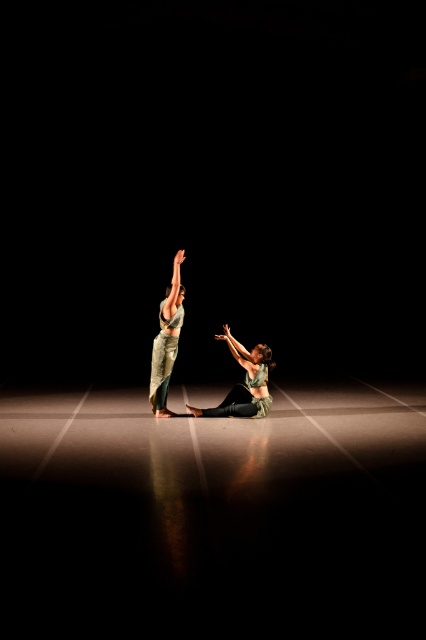
Question: Which point appears closest to the camera in this image?

Choices:
 (A) (262, 394)
 (B) (176, 320)

Answer: (B)

Question: Among these points, which one is farthest from the camera?

Choices:
 (A) (261, 346)
 (B) (163, 385)

Answer: (B)

Question: Does green fabric skirt at center have a greater width compared to matte green fabric at center?

Choices:
 (A) yes
 (B) no

Answer: (A)

Question: Which point is farther to the camera?

Choices:
 (A) (201, 416)
 (B) (178, 301)

Answer: (A)

Question: Does green fabric skirt at center lie behind matte green fabric at center?

Choices:
 (A) no
 (B) yes

Answer: (B)

Question: Is green fabric skirt at center to the left of matte green fabric at center from the viewer's perspective?

Choices:
 (A) yes
 (B) no

Answer: (B)